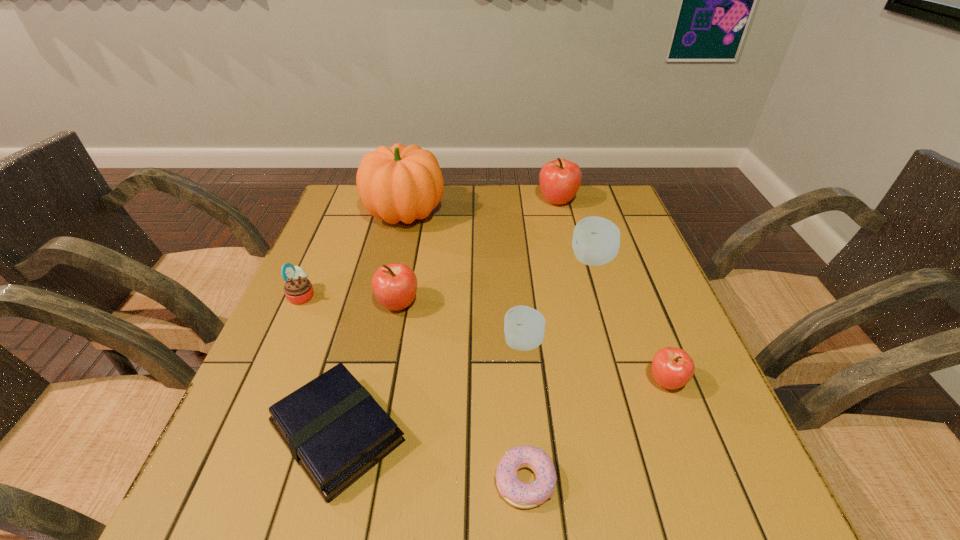
Where is `doughnut situated at the near edge`? doughnut situated at the near edge is located at coordinates (523, 495).

I want to click on pumpkin positioned at the left edge, so click(400, 183).

The height and width of the screenshot is (540, 960). Find the location of `muffin that is at the left edge`. muffin that is at the left edge is located at coordinates pyautogui.click(x=298, y=289).

Find the location of `book that is at the left edge`. book that is at the left edge is located at coordinates (335, 430).

This screenshot has width=960, height=540. I want to click on object that is at the far left corner, so click(400, 183).

This screenshot has height=540, width=960. Find the location of `object located in the near left corner section of the desktop`. object located in the near left corner section of the desktop is located at coordinates (335, 430).

Where is `object located at the far right corner`? This screenshot has height=540, width=960. object located at the far right corner is located at coordinates (560, 179).

In the image, there is a desktop. Find the location of `vacant area at the far edge`. vacant area at the far edge is located at coordinates (442, 217).

Find the location of `free space at the left edge of the desktop`. free space at the left edge of the desktop is located at coordinates (258, 468).

This screenshot has width=960, height=540. In order to click on vacant space at the right edge of the desktop in this screenshot , I will do `click(675, 346)`.